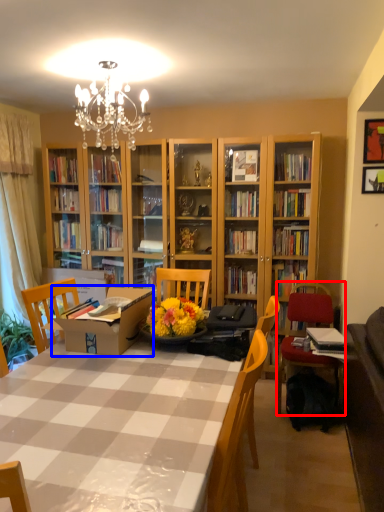
Question: Which object appears closest to the camera in this image, chair (highlighted by a red box) or cardboard box (highlighted by a blue box)?

Choices:
 (A) chair
 (B) cardboard box

Answer: (B)